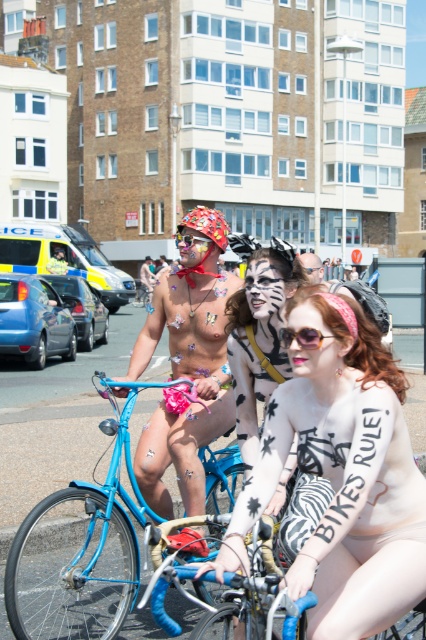
Question: Which point is farther to the camera?

Choices:
 (A) (408, 460)
 (B) (319, 266)

Answer: (B)

Question: Can you confirm if zebra print face paint at center is bigger than metallic body paint at center?

Choices:
 (A) yes
 (B) no

Answer: (B)

Question: Can you confirm if metallic body paint at center is positioned below clear plastic goggles at center?

Choices:
 (A) no
 (B) yes

Answer: (A)

Question: Which object is positioned farthest from the yellow metallic ambulance at upper left?

Choices:
 (A) shiny metallic bicycle at center
 (B) shiny metallic helmet at center
 (C) matte black sunglasses at center

Answer: (C)

Question: Considering the relative positions of shiny metallic helmet at center and pink plastic goggles at center in the image provided, where is shiny metallic helmet at center located with respect to pink plastic goggles at center?

Choices:
 (A) above
 (B) below

Answer: (A)

Question: Which object appears farthest from the camera in this image?

Choices:
 (A) clear plastic goggles at center
 (B) pink plastic goggles at center
 (C) shiny metallic helmet at center
 (D) shiny metallic mask at center

Answer: (A)